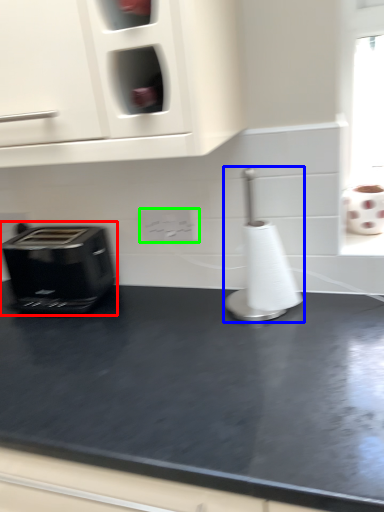
Question: Considering the real-world distances, which object is farthest from toaster (highlighted by a red box)? appliance (highlighted by a blue box) or electric outlet (highlighted by a green box)?

Choices:
 (A) appliance
 (B) electric outlet

Answer: (A)